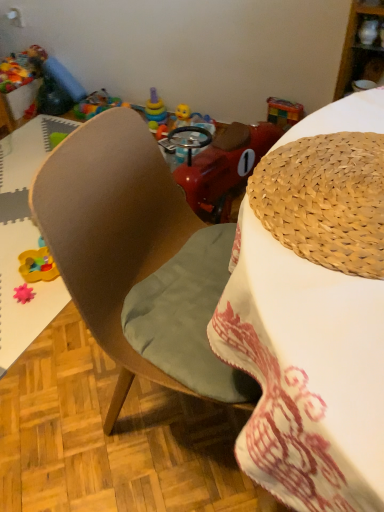
Where is `free space in front of pink rubber star at lower left, which appears as the first toy when ordered from the bottom`? free space in front of pink rubber star at lower left, which appears as the first toy when ordered from the bottom is located at coordinates [x=22, y=326].